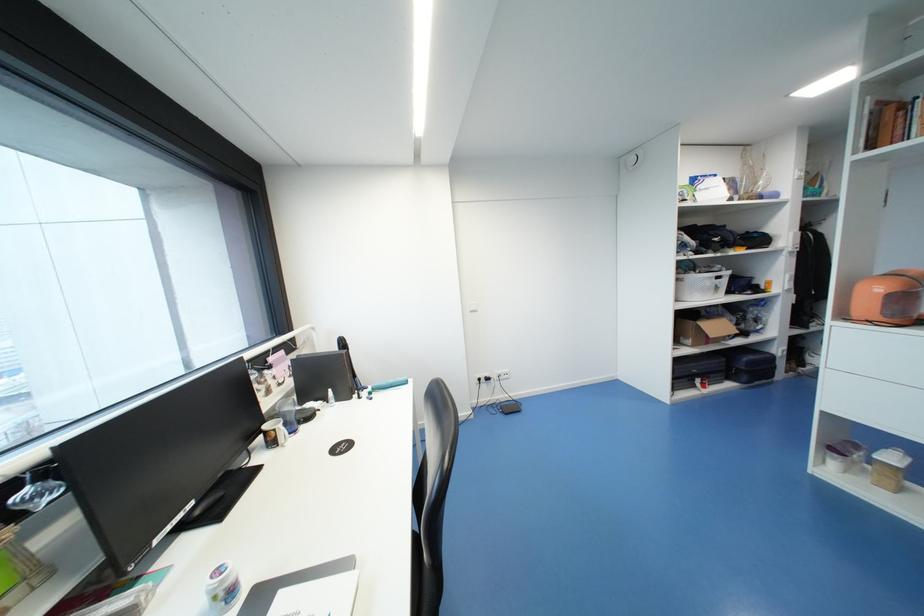
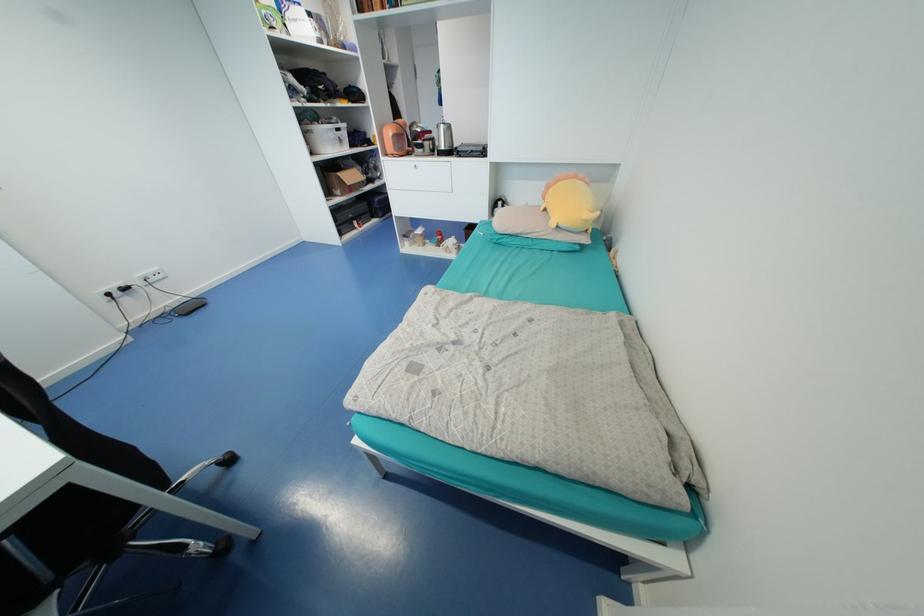
The point at (492,376) is marked in the first image. Where is the corresponding point in the second image?

(125, 285)